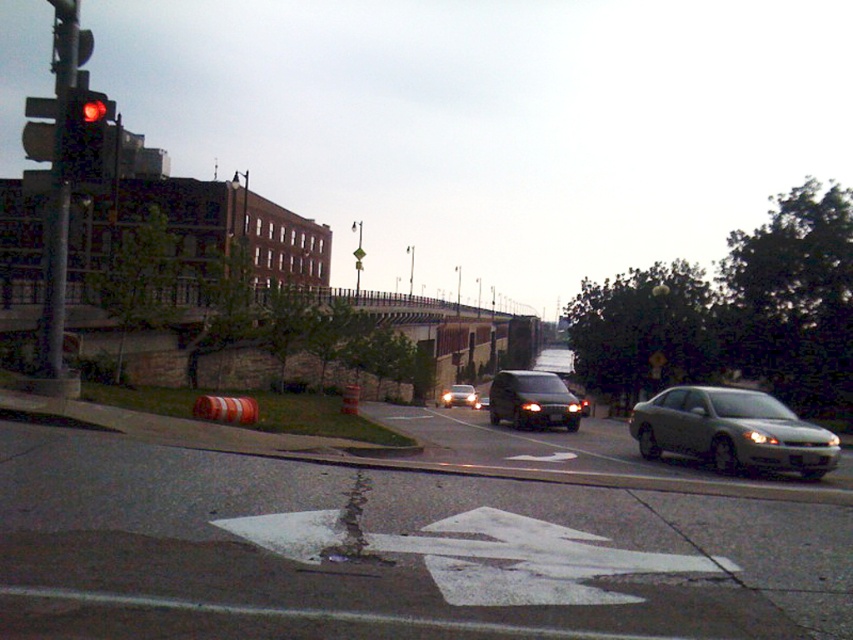
Question: Estimate the real-world distances between objects in this image. Which object is farther from the matte black van at center?

Choices:
 (A) satin silver sedan at right
 (B) satin black van at center
 (C) red glass traffic light at left

Answer: (C)

Question: Can you confirm if satin silver sedan at right is positioned to the right of satin black van at center?

Choices:
 (A) no
 (B) yes

Answer: (B)

Question: Which is nearer to the red glass traffic light at left?

Choices:
 (A) satin black van at center
 (B) satin silver sedan at right

Answer: (B)

Question: Considering the relative positions of matte black van at center and satin black van at center in the image provided, where is matte black van at center located with respect to satin black van at center?

Choices:
 (A) left
 (B) right

Answer: (B)

Question: Which object is closer to the camera taking this photo?

Choices:
 (A) matte black van at center
 (B) satin silver sedan at right
 (C) satin black van at center
 (D) red glass traffic light at left

Answer: (D)

Question: Considering the relative positions of satin silver sedan at right and satin black van at center in the image provided, where is satin silver sedan at right located with respect to satin black van at center?

Choices:
 (A) below
 (B) above

Answer: (B)